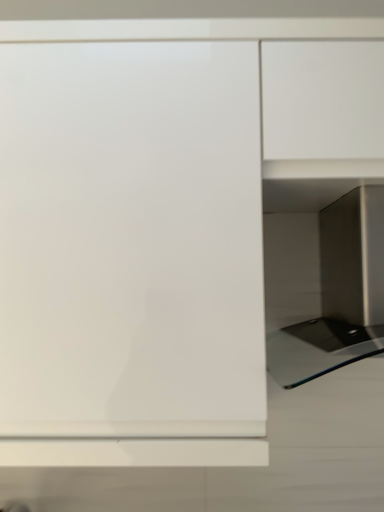
Measure the distance between point (x=346, y=292) and camera.

Point (x=346, y=292) and camera are 1.06 meters apart from each other.

Where is `satin black oven at lower right`? satin black oven at lower right is located at coordinates (324, 286).

Describe the element at coordinates (324, 286) in the screenshot. I see `satin black oven at lower right` at that location.

Image resolution: width=384 pixels, height=512 pixels. Identify the location of satin black oven at lower right. (324, 286).